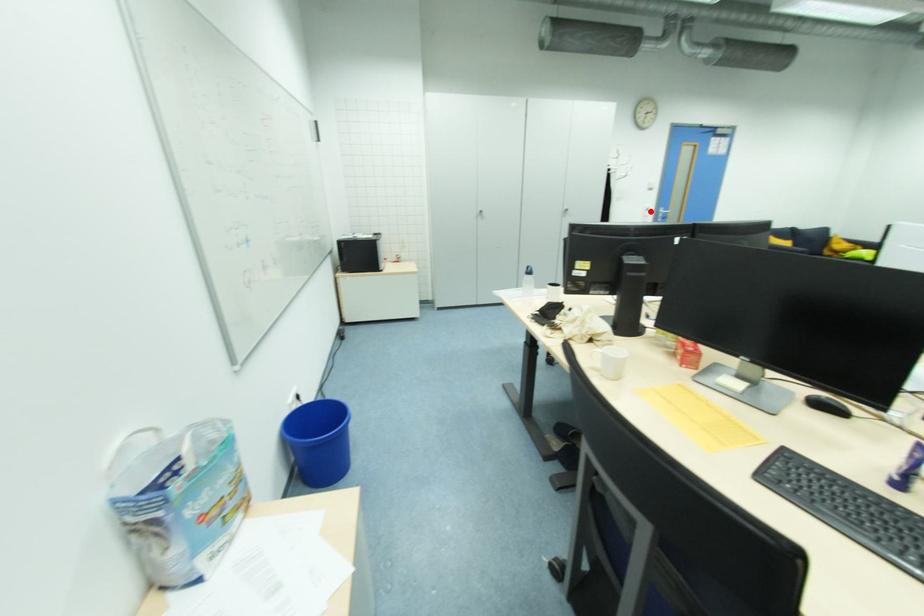
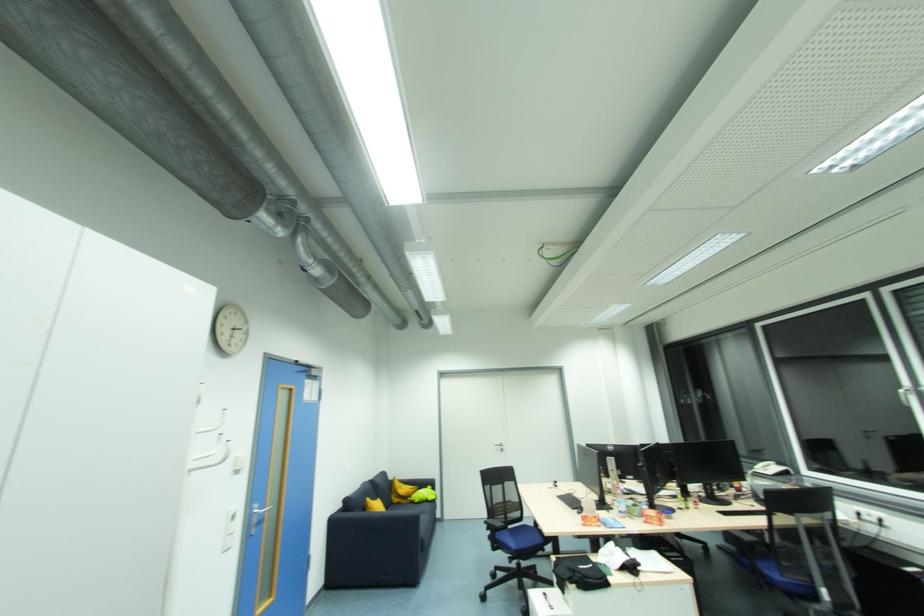
Question: A red point is marked in image1. In image2, is the corresponding 3D point closer to the camera or farther? Reply with the corresponding letter.

Choices:
 (A) The corresponding 3D point is closer.
 (B) The corresponding 3D point is farther.

Answer: (A)